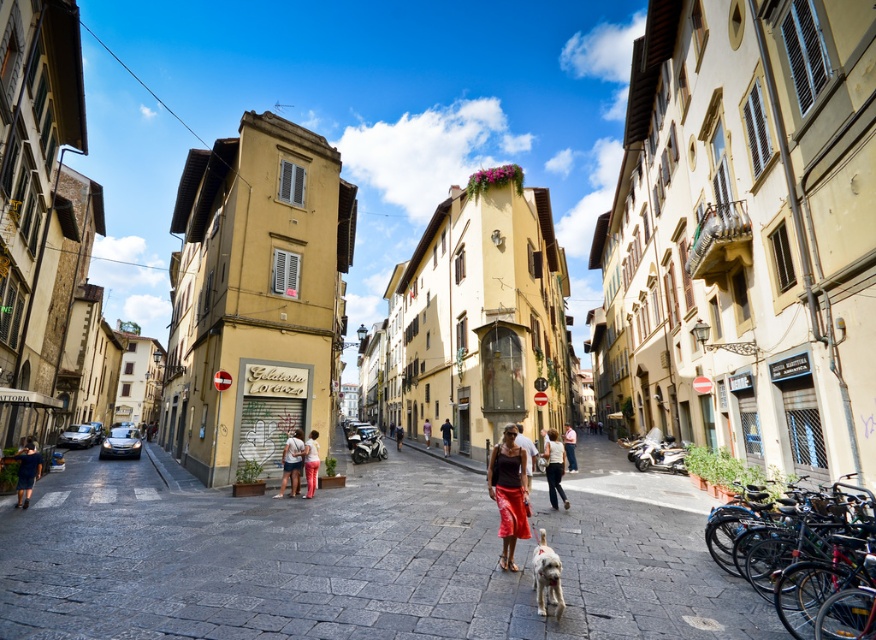
Please provide the 2D coordinates of the dark blue jeans at lower left in the image. The coordinates should be in the format of a point with two decimal places, such as point x, y. The image has a coordinate system where the origin is at the bottom left corner, with the x and y axes increasing to the right and up respectively.

The dark blue jeans at lower left is located at point (27, 472).

You are standing on the cobblestone street in the historic town and want to walk from point A to point B. Point A is at coordinates point (491, 492) and point B is at coordinates point (292, 449). Which point should you start from if you want to begin your walk closer to the buildings with traditional shutters?

You should start from point A at coordinates point (491, 492) because it is closer to the viewer than point B at coordinates point (292, 449), meaning it is nearer to the buildings with traditional shutters.

You are standing on the street and see both the matte black tank top at center and the matte white shirt at center. Which one is nearer to you?

The matte black tank top at center is closer to the viewer than the matte white shirt at center.